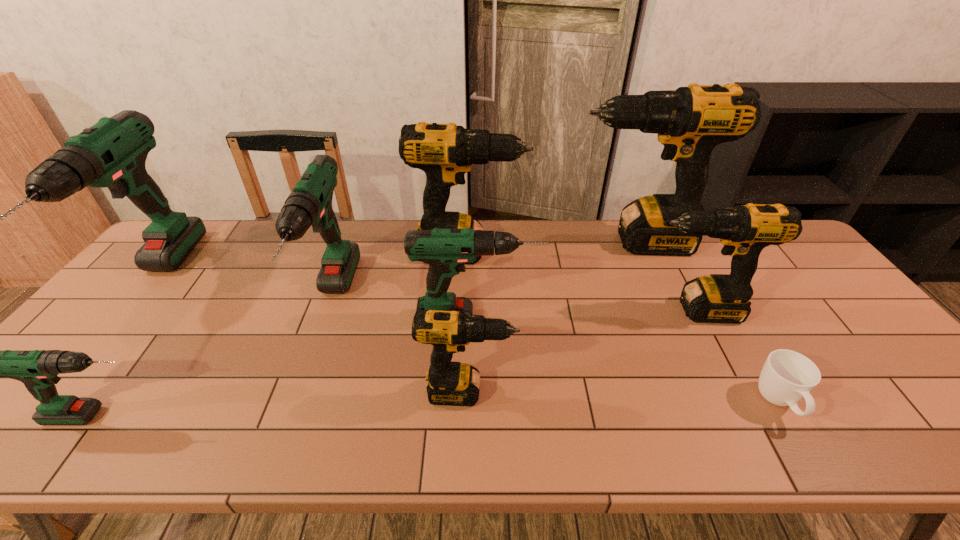
You are a GUI agent. You are given a task and a screenshot of the screen. Output one action in this format:
    pyautogui.click(x=<x>, y=<y>)
    Task: Click on the cup
    
    Given the screenshot: What is the action you would take?
    pyautogui.click(x=787, y=376)

Where is `free space located at the tip of the biggest black drill`? The width and height of the screenshot is (960, 540). free space located at the tip of the biggest black drill is located at coordinates (503, 242).

Identify the location of free space located 0.090m at the tip of the biggest black drill. The height and width of the screenshot is (540, 960). (542, 242).

I want to click on vacant space situated 0.200m at the tip of the biggest black drill, so click(x=509, y=242).

At what (x,y) coordinates should I click in order to perform the action: click on free space located on the handle side of the biggest green drill. Please return your answer as a coordinate pair (x, y). This screenshot has width=960, height=540. Looking at the image, I should click on (26, 432).

Where is `vacant space situated at the tip of the third smallest black drill`? vacant space situated at the tip of the third smallest black drill is located at coordinates [x=571, y=252].

The image size is (960, 540). Identify the location of vacant region located on the handle side of the third green drill from left to right. pos(282,440).

The width and height of the screenshot is (960, 540). Find the location of `free location located at the tip of the third biggest black drill`. free location located at the tip of the third biggest black drill is located at coordinates (610, 310).

At what (x,y) coordinates should I click in order to perform the action: click on vacant space located at the tip of the third biggest black drill. Please return your answer as a coordinate pair (x, y). This screenshot has width=960, height=540. Looking at the image, I should click on (624, 310).

The image size is (960, 540). Identify the location of vacant space located at the tip of the third biggest black drill. (519, 310).